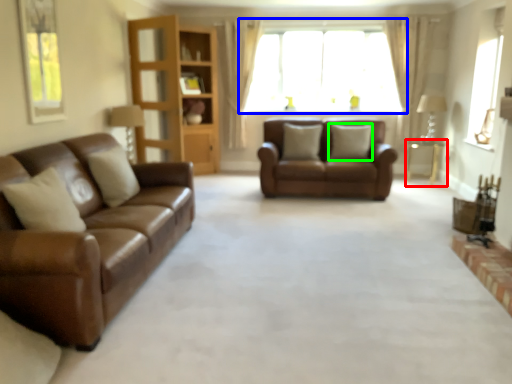
Question: Considering the real-world distances, which object is closest to table (highlighted by a red box)? window (highlighted by a blue box) or pillow (highlighted by a green box).

Choices:
 (A) window
 (B) pillow

Answer: (B)